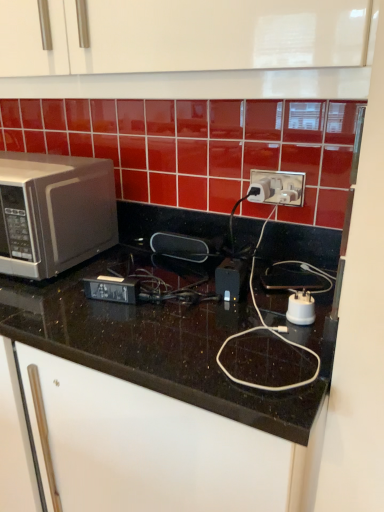
At what (x,y) coordinates should I click in order to perform the action: click on free space above satin silver microwave at left (from a real-world perspective). Please return your answer as a coordinate pair (x, y). The height and width of the screenshot is (512, 384). Looking at the image, I should click on (24, 158).